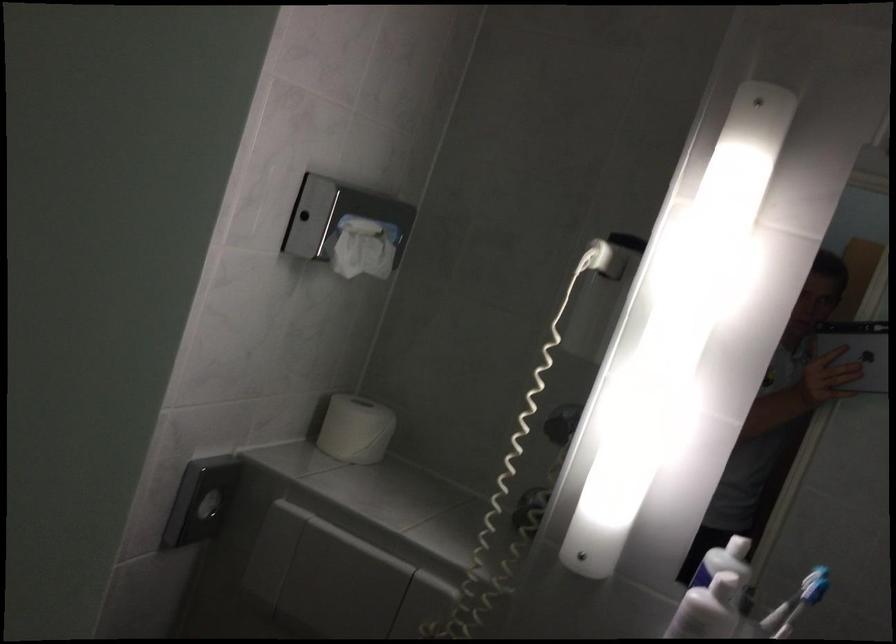
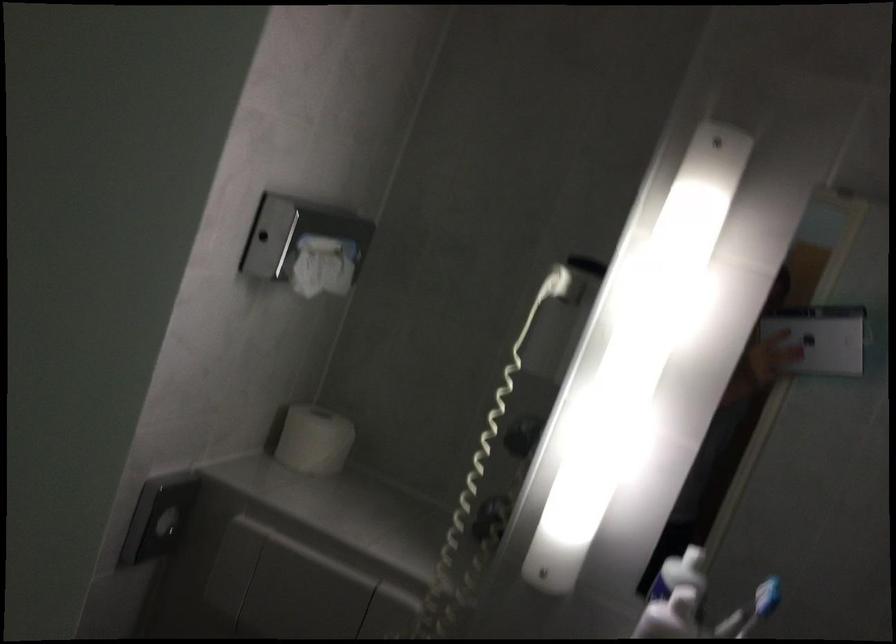
Question: Based on the continuous images, in which direction is the camera rotating? Reply with the corresponding letter.

Choices:
 (A) Left
 (B) Right
 (C) Up
 (D) Down

Answer: (B)